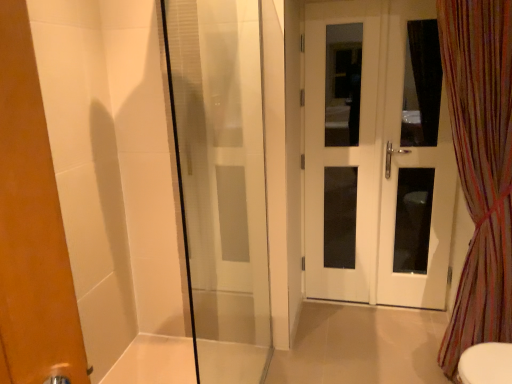
Question: Which is correct: white glass door at right, the 1th screen door positioned from the right, is inside transparent glass shower door at left, or outside of it?

Choices:
 (A) inside
 (B) outside

Answer: (B)

Question: In terms of height, does white glass door at right, which ranks as the second screen door in left-to-right order, look taller or shorter compared to transparent glass shower door at left?

Choices:
 (A) tall
 (B) short

Answer: (A)

Question: Based on their relative distances, which object is farther from the white glossy door at center, the 1th screen door from the left?

Choices:
 (A) white glass door at right, the 1th screen door positioned from the right
 (B) transparent glass shower door at left
 (C) multicolored striped curtain at right
 (D) white glossy door at right

Answer: (C)

Question: Based on their relative distances, which object is farther from the white glass door at right, the 1th screen door positioned from the right?

Choices:
 (A) multicolored striped curtain at right
 (B) white glossy door at center, the second screen door positioned from the right
 (C) transparent glass shower door at left
 (D) white glossy door at right

Answer: (C)